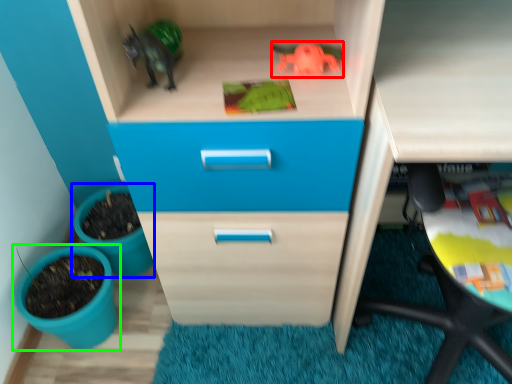
Question: Which object is positioned farthest from toy (highlighted by a red box)? Select from flowerpot (highlighted by a blue box) and flowerpot (highlighted by a green box).

Choices:
 (A) flowerpot
 (B) flowerpot

Answer: (B)